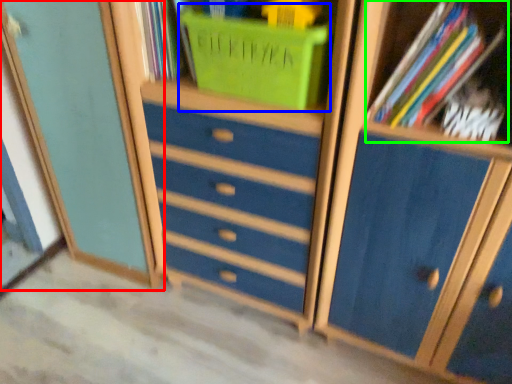
Question: Considering the real-world distances, which object is closest to cupboard (highlighted by a red box)? basket (highlighted by a blue box) or book (highlighted by a green box).

Choices:
 (A) basket
 (B) book

Answer: (A)